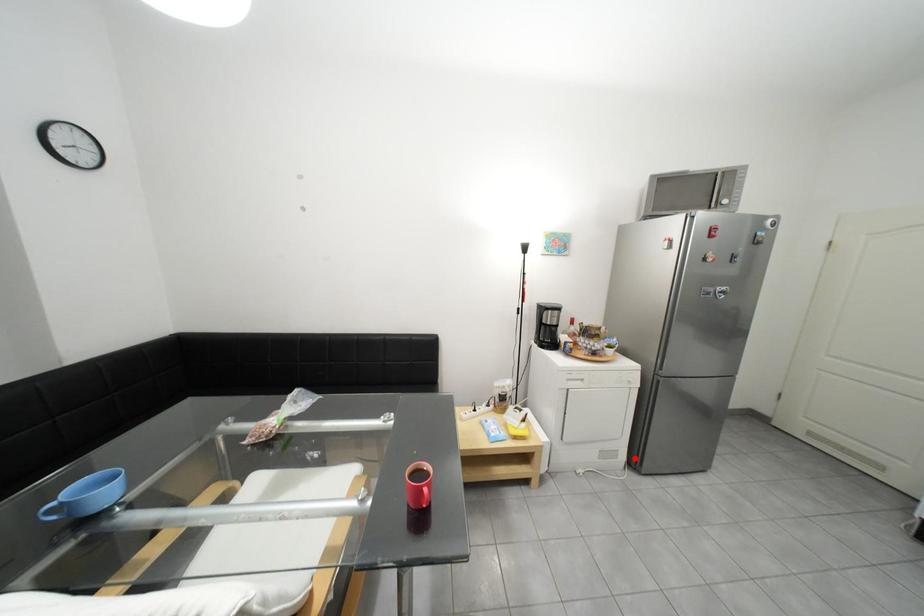
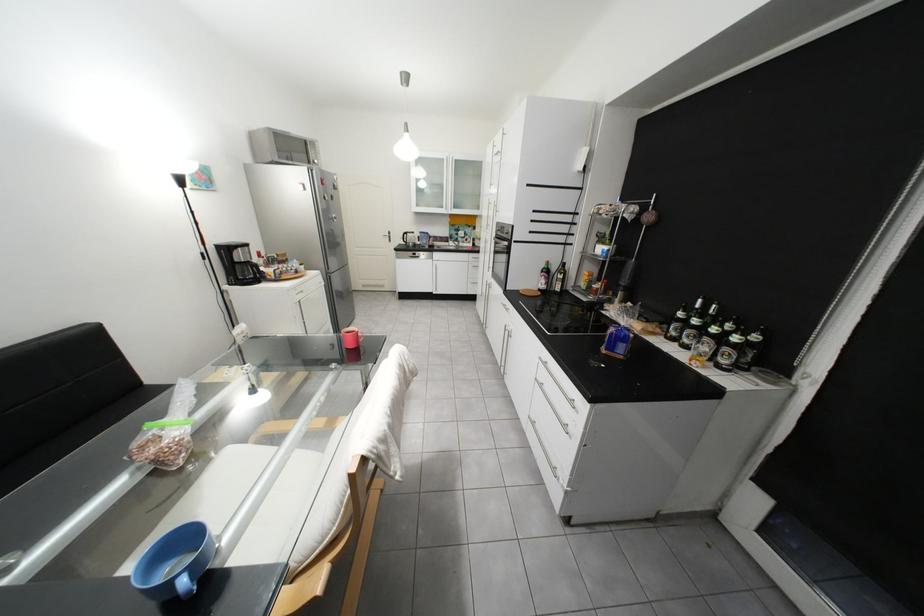
Question: A red point is marked in image1. In image2, is the corresponding 3D point closer to the camera or farther? Reply with the corresponding letter.

Choices:
 (A) The corresponding 3D point is closer.
 (B) The corresponding 3D point is farther.

Answer: (B)